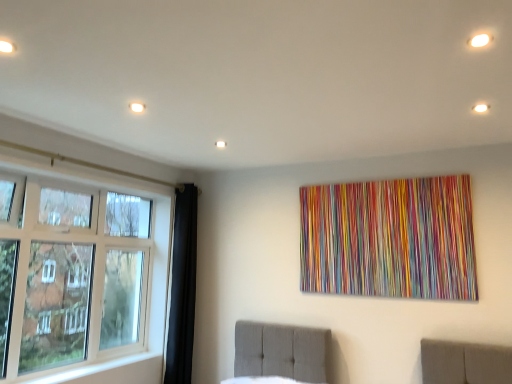
Question: From the image's perspective, relative to white matte light fixture at upper left, the 1th light positioned from the left, is white glass window at left above or below?

Choices:
 (A) below
 (B) above

Answer: (A)

Question: In terms of size, does white glass window at left appear bigger or smaller than white matte light fixture at upper left, the second light in the right-to-left sequence?

Choices:
 (A) small
 (B) big

Answer: (B)

Question: Considering the real-world distances, which object is closest to the white glass window at left?

Choices:
 (A) white matte light fixture at upper left, the 1th light positioned from the left
 (B) white glossy light at upper right, which is the second light from left to right

Answer: (A)

Question: Estimate the real-world distances between objects in this image. Which object is closer to the white matte light fixture at upper left, the 1th light positioned from the left?

Choices:
 (A) white glossy light at upper right, which is the second light from left to right
 (B) white glass window at left

Answer: (B)